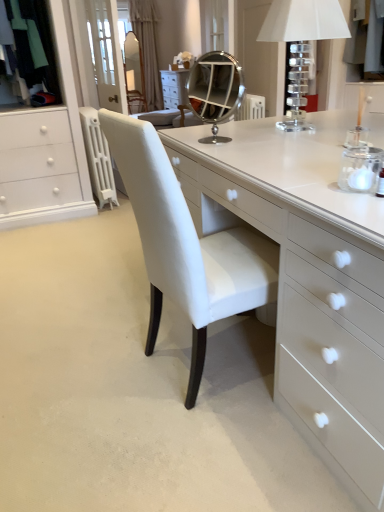
Question: In which direction should I rotate to look at matte glass mirror at upper center, the 2th mirror from the right?

Choices:
 (A) right
 (B) left

Answer: (B)

Question: Can you confirm if silver/metallic mirror at center, which ranks as the 2th mirror in top-to-bottom order, is taller than matte glass mirror at upper center, the 2th mirror from the right?

Choices:
 (A) no
 (B) yes

Answer: (A)

Question: Does silver/metallic mirror at center, which is the second mirror from back to front, touch matte glass mirror at upper center, the 2th mirror from the right?

Choices:
 (A) yes
 (B) no

Answer: (B)

Question: From a real-world perspective, does silver/metallic mirror at center, the 2th mirror when ordered from left to right, sit lower than matte glass mirror at upper center, arranged as the 1th mirror when viewed from the top?

Choices:
 (A) yes
 (B) no

Answer: (B)

Question: From the image's perspective, is silver/metallic mirror at center, which ranks as the 2th mirror in top-to-bottom order, located beneath matte glass mirror at upper center, the 2th mirror from the right?

Choices:
 (A) yes
 (B) no

Answer: (A)

Question: Does silver/metallic mirror at center, which is the second mirror from back to front, contain matte glass mirror at upper center, arranged as the 1th mirror when viewed from the top?

Choices:
 (A) no
 (B) yes

Answer: (A)

Question: From a real-world perspective, does silver/metallic mirror at center, which is the second mirror from back to front, stand above matte glass mirror at upper center, which ranks as the 1th mirror in left-to-right order?

Choices:
 (A) no
 (B) yes

Answer: (B)

Question: Can you confirm if gray fabric coat at upper right is smaller than white textured curtain at upper center?

Choices:
 (A) no
 (B) yes

Answer: (B)

Question: From the image's perspective, is gray fabric coat at upper right below white textured curtain at upper center?

Choices:
 (A) yes
 (B) no

Answer: (A)

Question: Considering the relative sizes of gray fabric coat at upper right and white textured curtain at upper center in the image provided, is gray fabric coat at upper right bigger than white textured curtain at upper center?

Choices:
 (A) yes
 (B) no

Answer: (B)

Question: From a real-world perspective, is gray fabric coat at upper right on top of white textured curtain at upper center?

Choices:
 (A) no
 (B) yes

Answer: (B)

Question: Is gray fabric coat at upper right taller than white textured curtain at upper center?

Choices:
 (A) no
 (B) yes

Answer: (A)

Question: Is gray fabric coat at upper right not close to white textured curtain at upper center?

Choices:
 (A) no
 (B) yes

Answer: (B)

Question: Is gray fabric coat at upper right positioned far away from matte glass mirror at upper center, positioned as the 2th mirror in bottom-to-top order?

Choices:
 (A) no
 (B) yes

Answer: (B)